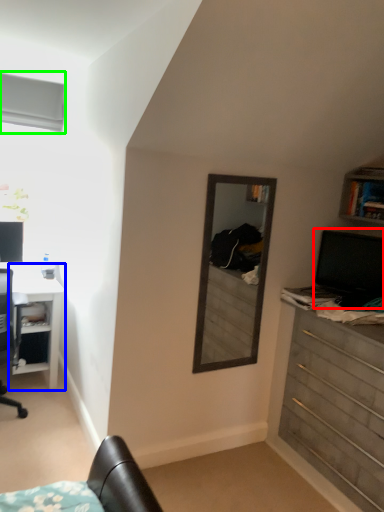
Question: Which is farther away from computer monitor (highlighted by a red box)? desk (highlighted by a blue box) or window (highlighted by a green box)?

Choices:
 (A) desk
 (B) window

Answer: (B)